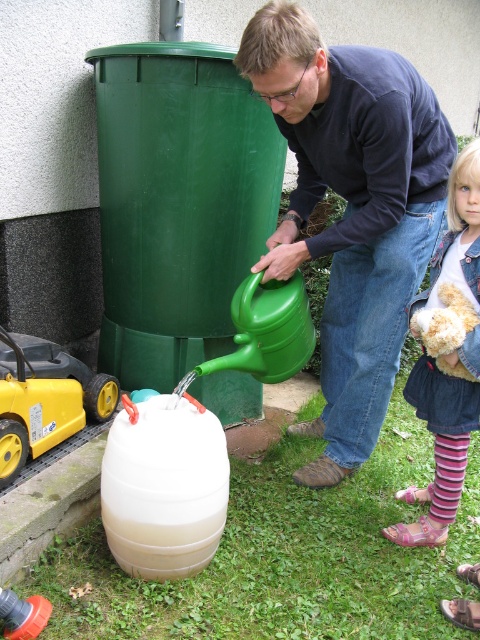
You are standing at the point marked by the coordinate (164, 486) in the image. What object are you directly in front of?

The translucent plastic barrel at lower center is represented by point (164, 486), so you are directly in front of the translucent plastic barrel at lower center.

You are standing at the center of the image and want to place a new object at the same position as the denim jacket at lower right. What are the coordinates you should use?

Result: The coordinates for the denim jacket at lower right are 0.683 and 0.921.